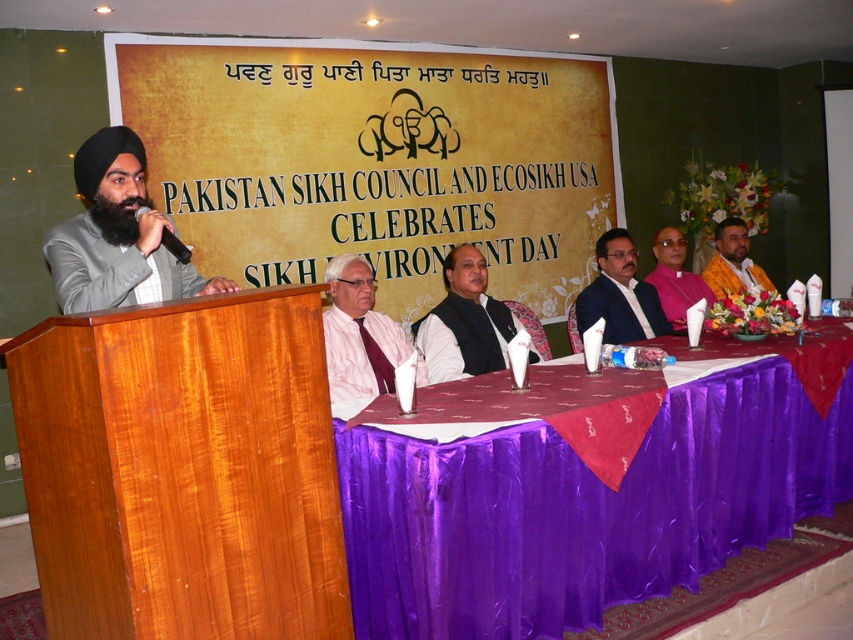
You are attending this event and want to take a photo of the speaker in his matte gray suit at left and the banner in the dark blue fabric at center. To ensure both are in frame, should you position yourself to the left or right of the stage?

You should position yourself to the right of the stage because the matte gray suit at left is to the left of the dark blue fabric at center, so placing yourself to the right will keep both in the frame.

You are a photographer standing at the back of the event venue. You want to capture a photo of the purple satin tablecloth at lower center. Based on its coordinates, where should you aim your camera?

The purple satin tablecloth at lower center is located at coordinates point (589, 502), so aim your camera towards that point to capture it.